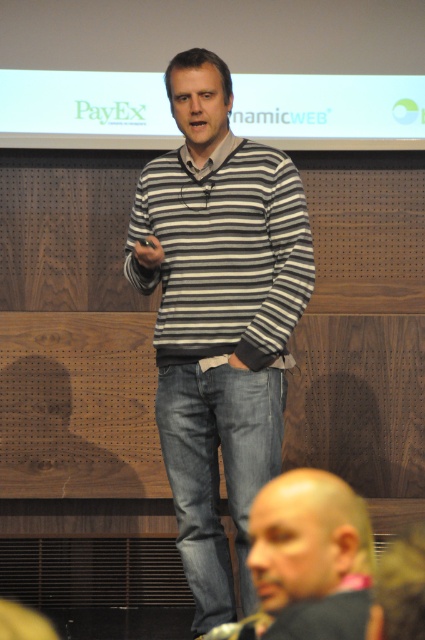
Question: From the image, what is the correct spatial relationship of striped sweater at center in relation to bald head at lower right?

Choices:
 (A) right
 (B) left

Answer: (B)

Question: Which point appears farthest from the camera in this image?

Choices:
 (A) (265, 566)
 (B) (200, 182)
 (C) (210, 288)

Answer: (B)

Question: Among these points, which one is farthest from the camera?

Choices:
 (A) (303, 522)
 (B) (155, 332)

Answer: (B)

Question: Where is striped sweater at center located in relation to striped cotton sweater at center in the image?

Choices:
 (A) right
 (B) left

Answer: (A)

Question: Is striped sweater at center positioned before striped cotton sweater at center?

Choices:
 (A) yes
 (B) no

Answer: (B)

Question: Among these objects, which one is farthest from the camera?

Choices:
 (A) bald head at lower right
 (B) striped cotton sweater at center
 (C) striped sweater at center

Answer: (C)